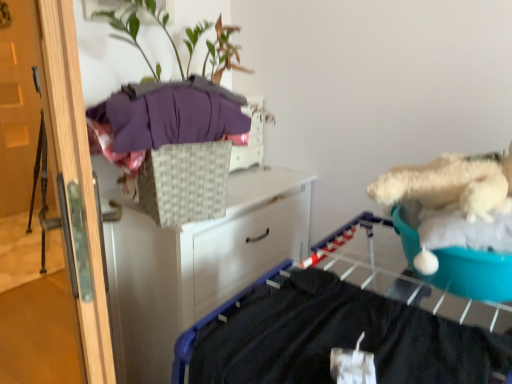
Question: From the image's perspective, is teal fabric at right above or below green leafy plant at upper center?

Choices:
 (A) below
 (B) above

Answer: (A)

Question: In the image, is teal fabric at right on the left side or the right side of green leafy plant at upper center?

Choices:
 (A) right
 (B) left

Answer: (A)

Question: Which is farther from the wooden door at left?

Choices:
 (A) white woven basket at upper center
 (B) purple soft fabric at upper left
 (C) green leafy plant at upper center
 (D) teal fabric at right
 (E) white woven basket at upper center

Answer: (D)

Question: Considering the real-world distances, which object is farthest from the green leafy plant at upper center?

Choices:
 (A) wooden door at left
 (B) teal fabric at right
 (C) white woven basket at upper center
 (D) white woven basket at upper center
 (E) purple soft fabric at upper left

Answer: (A)